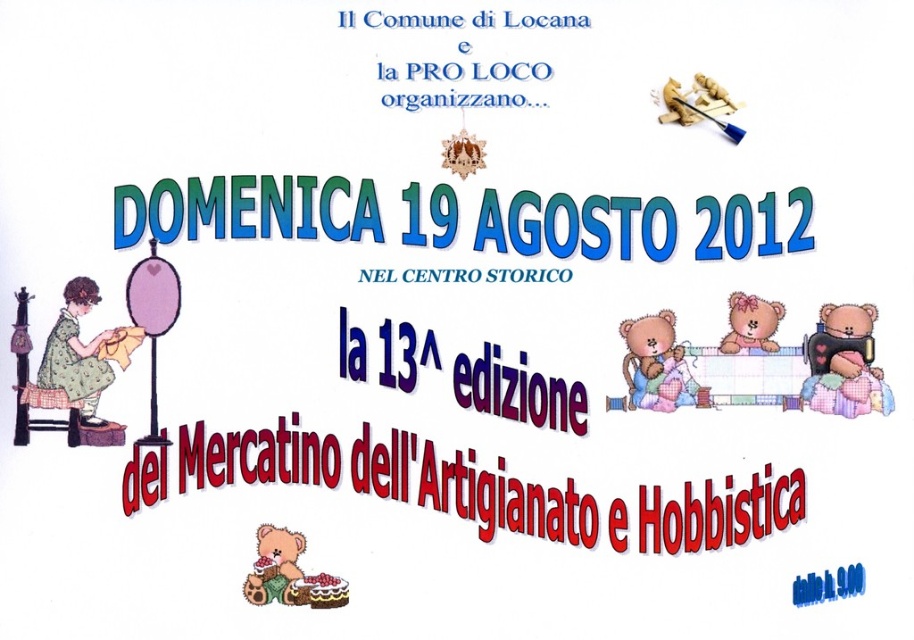
Does fluffy pink teddy at upper right appear on the left side of fluffy beige teddy bear at lower left?

Incorrect, fluffy pink teddy at upper right is not on the left side of fluffy beige teddy bear at lower left.

Identify the location of fluffy pink teddy at upper right. The height and width of the screenshot is (640, 914). (655, 364).

I want to click on fluffy pink teddy at upper right, so click(655, 364).

Where is `fluffy pink teddy at upper right`? fluffy pink teddy at upper right is located at coordinates (655, 364).

Is fluffy beige teddy bear at lower left below wooden stool at lower left?

Correct, fluffy beige teddy bear at lower left is located below wooden stool at lower left.

Does point (290, 531) come behind point (56, 401)?

No, it is not.

Locate an element on the screen. fluffy beige teddy bear at lower left is located at coordinates (275, 566).

Where is `fluffy beige teddy bear at lower left`? The image size is (914, 640). fluffy beige teddy bear at lower left is located at coordinates (275, 566).

Does point (285, 595) come behind point (752, 296)?

No.

Find the location of `fluffy beige teddy bear at lower left`. fluffy beige teddy bear at lower left is located at coordinates (275, 566).